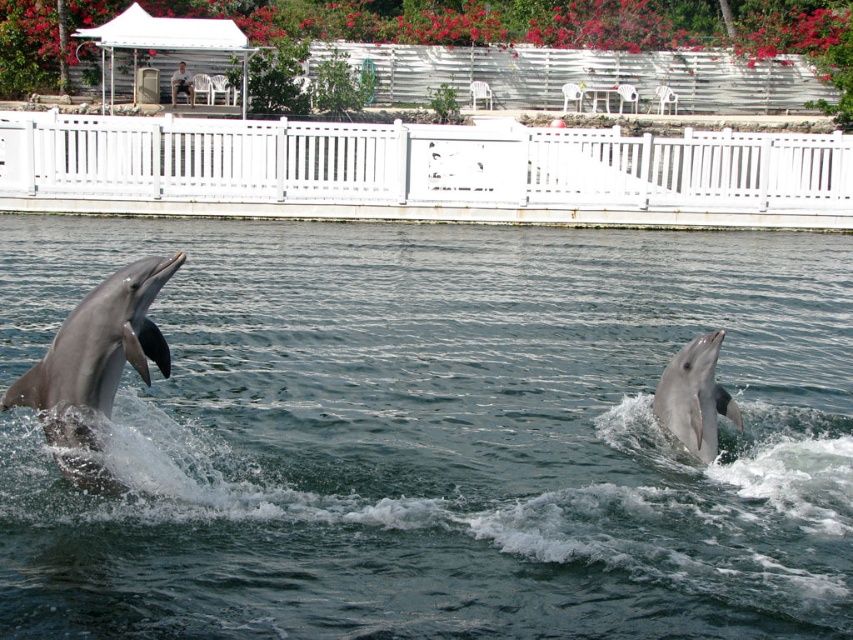
Based on the photo, can you confirm if clear water at dolphins left is taller than gray smooth dolphin at left?

Indeed, clear water at dolphins left has a greater height compared to gray smooth dolphin at left.

Describe the element at coordinates (436, 435) in the screenshot. I see `clear water at dolphins left` at that location.

Identify the location of clear water at dolphins left. (436, 435).

In the scene shown: How distant is gray smooth dolphin at right from white plastic chair at upper center?

A distance of 29.14 meters exists between gray smooth dolphin at right and white plastic chair at upper center.

Is gray smooth dolphin at right further to camera compared to white plastic chair at upper center?

No, gray smooth dolphin at right is closer to the viewer.

Does point (666, 385) come farther from viewer compared to point (184, 72)?

No, (666, 385) is closer to viewer.

Locate an element on the screen. The width and height of the screenshot is (853, 640). gray smooth dolphin at right is located at coordinates (694, 397).

Between gray smooth dolphin at left and white plastic chair at upper center, which one appears on the left side from the viewer's perspective?

From the viewer's perspective, white plastic chair at upper center appears more on the left side.

Measure the distance between gray smooth dolphin at left and camera.

gray smooth dolphin at left is 6.43 meters from camera.

Between point (164, 268) and point (183, 76), which one is positioned behind?

The point (183, 76) is more distant.

You are a GUI agent. You are given a task and a screenshot of the screen. Output one action in this format:
    pyautogui.click(x=<x>, y=<y>)
    Task: Click on the gray smooth dolphin at left
    
    Given the screenshot: What is the action you would take?
    pyautogui.click(x=96, y=353)